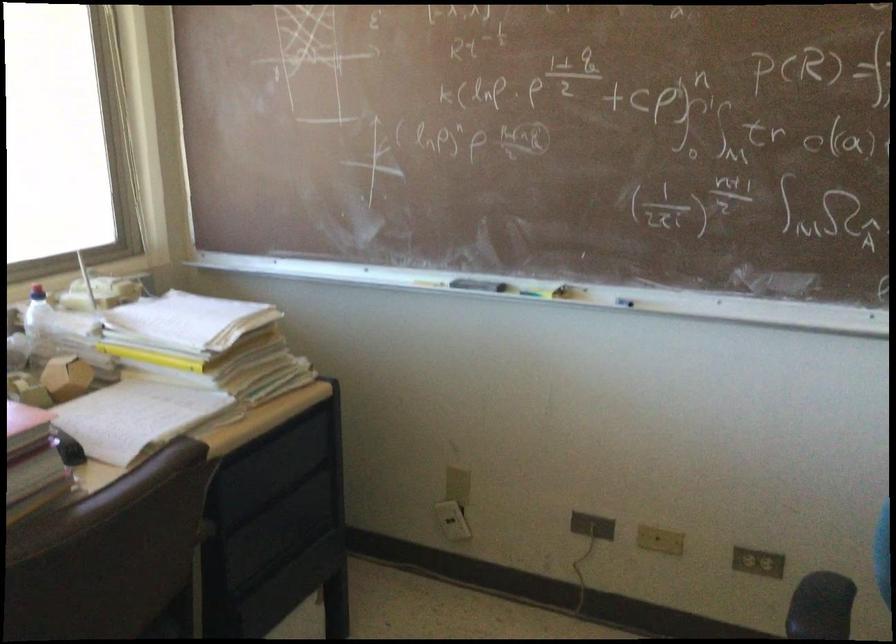
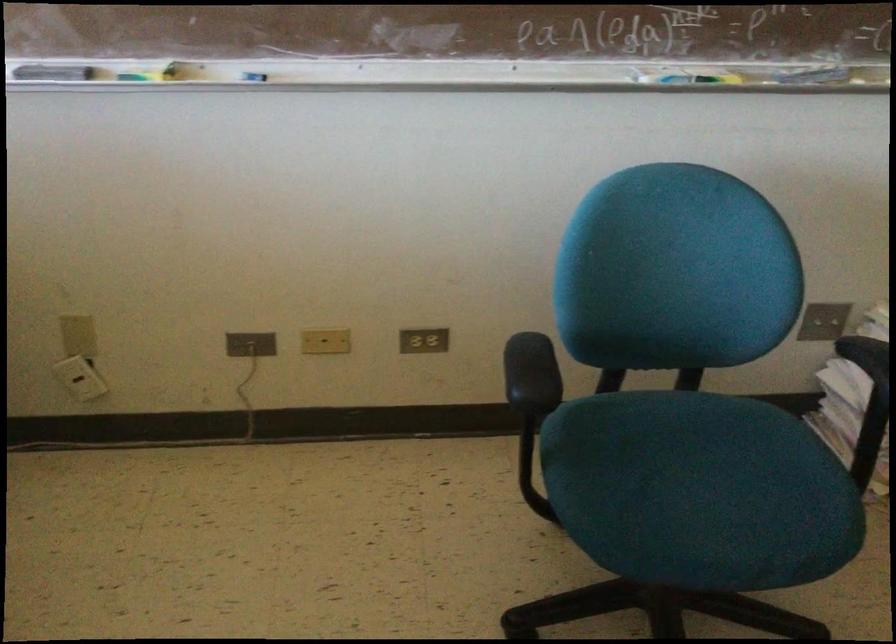
Where in the second image is the point corresponding to pixel 591 527 from the first image?

(250, 344)